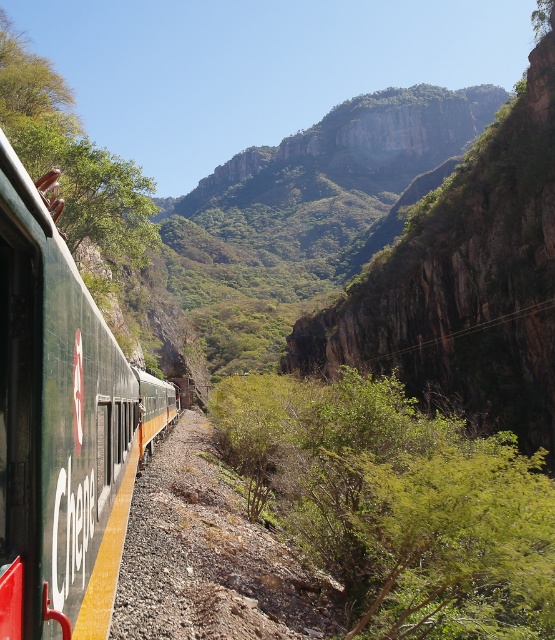
Question: Which point is closer to the camera taking this photo?

Choices:
 (A) (385, 330)
 (B) (9, 387)

Answer: (B)

Question: Which point is farther to the camera?

Choices:
 (A) green matte train at left
 (B) green rocky cliff at upper center

Answer: (B)

Question: Which point is closer to the camera taking this photo?

Choices:
 (A) tap(48, 436)
 (B) tap(435, 355)

Answer: (A)

Question: Is green rocky cliff at upper center thinner than green matte train at left?

Choices:
 (A) no
 (B) yes

Answer: (A)

Question: Can you confirm if green rocky cliff at upper center is positioned below green matte train at left?

Choices:
 (A) no
 (B) yes

Answer: (A)

Question: Is green rocky cliff at upper center thinner than green matte train at left?

Choices:
 (A) no
 (B) yes

Answer: (A)